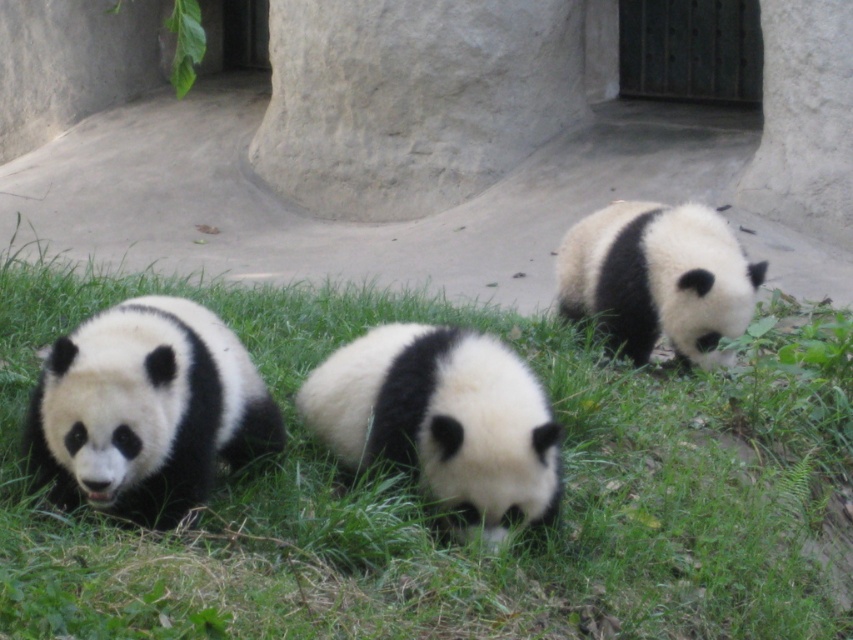
From the picture: Between black and white fur panda at left and white soft fur panda at center, which one has less height?

white soft fur panda at center is shorter.

Does black and white fur panda at left have a larger size compared to white soft fur panda at center?

Incorrect, black and white fur panda at left is not larger than white soft fur panda at center.

Between point (273, 426) and point (412, 408), which one is positioned behind?

The point (273, 426) is more distant.

Identify the location of black and white fur panda at left. Image resolution: width=853 pixels, height=640 pixels. (146, 410).

Who is more distant from viewer, (590, 442) or (482, 365)?

Positioned behind is point (590, 442).

Between point (316, 456) and point (511, 484), which one is positioned in front?

Positioned in front is point (511, 484).

What are the coordinates of `green grass at center` in the screenshot? It's located at (416, 502).

Who is shorter, black and white fur panda at left or white fur panda at center?

Standing shorter between the two is black and white fur panda at left.

Does point (45, 461) come farther from viewer compared to point (573, 282)?

No, (45, 461) is in front of (573, 282).

What do you see at coordinates (146, 410) in the screenshot? The height and width of the screenshot is (640, 853). I see `black and white fur panda at left` at bounding box center [146, 410].

Locate an element on the screen. This screenshot has height=640, width=853. black and white fur panda at left is located at coordinates (146, 410).